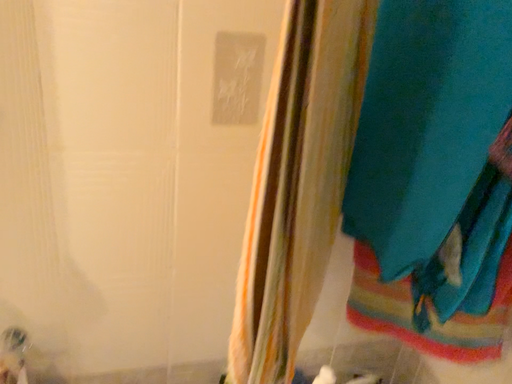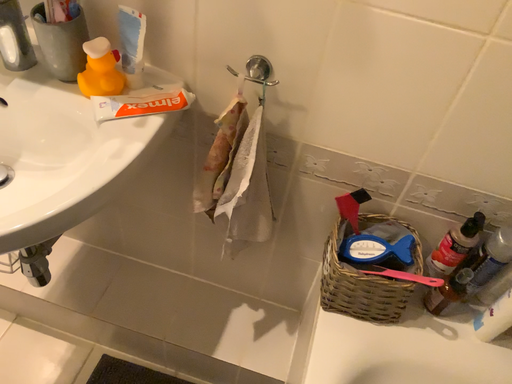
Question: Which way did the camera rotate in the video?

Choices:
 (A) rotated downward
 (B) rotated upward

Answer: (A)